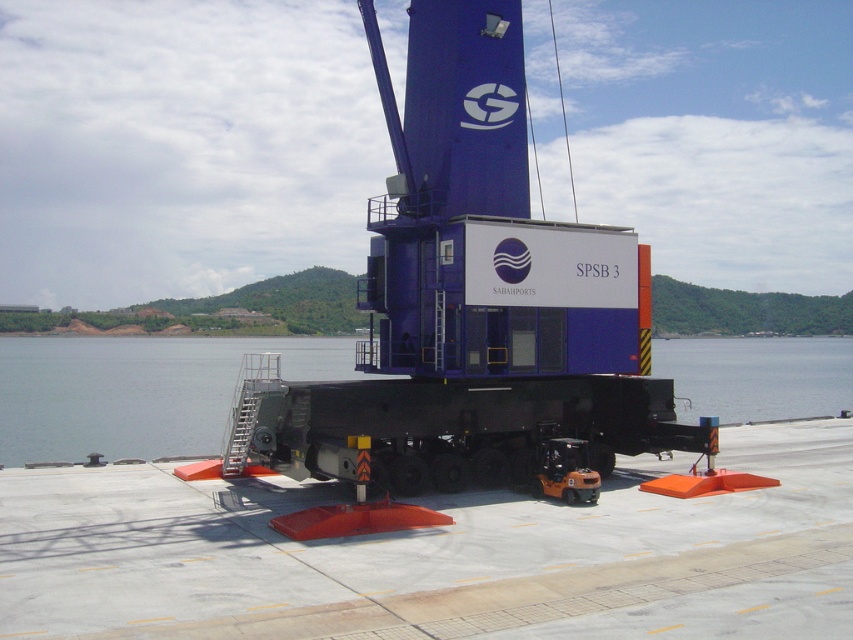
Is concrete tarmac at center positioned before transparent water at center?

Yes.

Which is above, concrete tarmac at center or transparent water at center?

transparent water at center

Is point (403, 582) more distant than point (10, 396)?

No.

Find the location of a particular element. The width and height of the screenshot is (853, 640). concrete tarmac at center is located at coordinates coord(438,556).